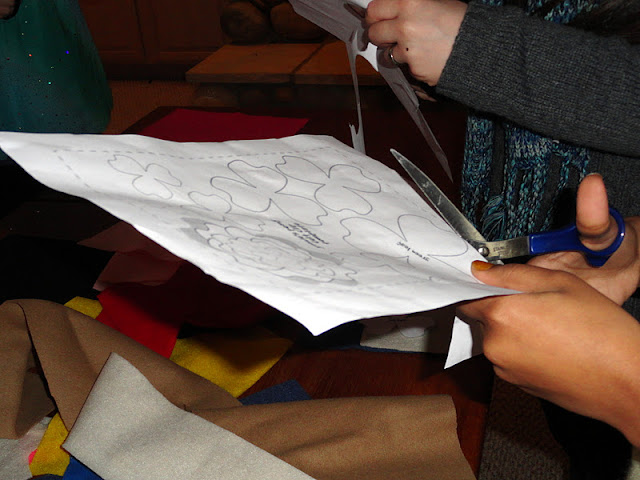
Identify the location of table top. The width and height of the screenshot is (640, 480). (342, 377).